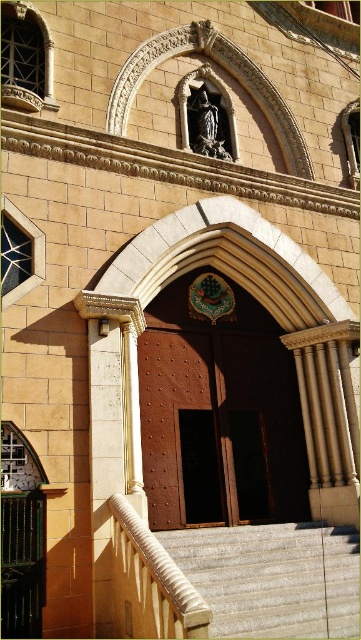
Question: Can you confirm if light gray concrete stairs at lower center is bigger than brown wooden door at center?

Choices:
 (A) no
 (B) yes

Answer: (B)

Question: Can you confirm if light gray concrete stairs at lower center is positioned to the left of brown wooden door at center?

Choices:
 (A) no
 (B) yes

Answer: (A)

Question: Estimate the real-world distances between objects in this image. Which object is farther from the brown polished wood door at center?

Choices:
 (A) light gray concrete stairs at lower center
 (B) brown wooden door at center

Answer: (A)

Question: Which of the following is the farthest from the observer?

Choices:
 (A) (223, 621)
 (B) (219, 442)

Answer: (B)

Question: Which point is farther to the camera?

Choices:
 (A) brown wooden door at center
 (B) light gray concrete stairs at lower center

Answer: (A)

Question: Does brown polished wood door at center have a greater width compared to light gray concrete stairs at lower center?

Choices:
 (A) yes
 (B) no

Answer: (B)